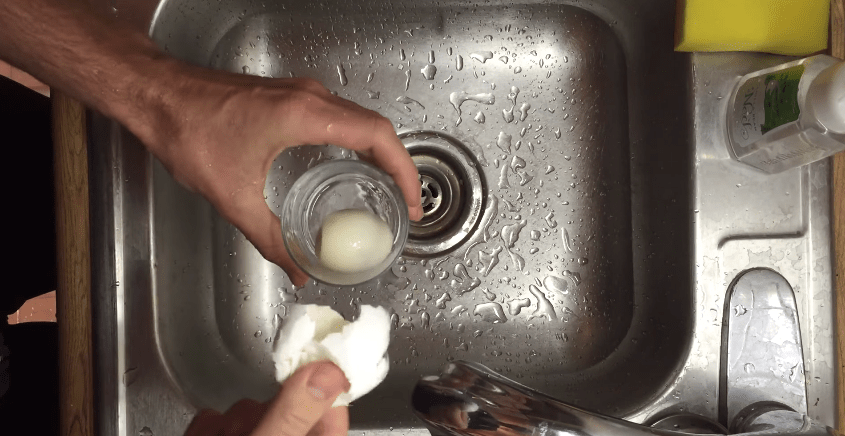
The width and height of the screenshot is (845, 436). Find the location of `sink drain`. sink drain is located at coordinates (428, 191).